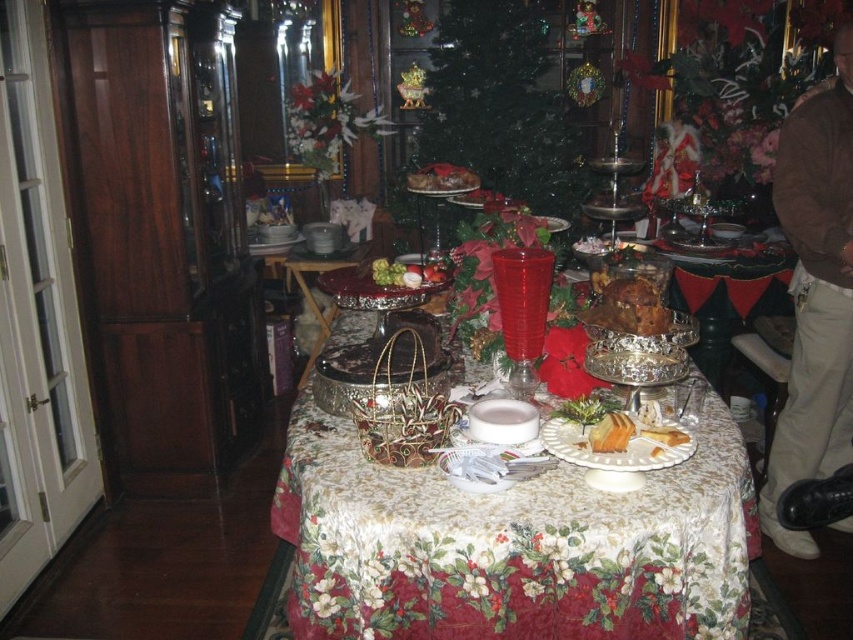
You are a guest at the Christmas dinner and want to take a photo of the shiny silver cake stand at center and the yellow cake at center. Which object should you focus on first if you want to capture both in a single frame without moving the camera?

You should focus on the shiny silver cake stand at center first because it is larger than the yellow cake at center, allowing it to be centered in the frame while still capturing the smaller yellow cake at center in the same shot.

You are a guest at a Christmas party and want to place a small gift box on the table. The gift box is 10 cm wide. Looking at the table, which object between the shiny silver cake stand at center and the yellow cake at center has enough space to place the gift box next to it?

The shiny silver cake stand at center has a larger width than the yellow cake at center, so placing the gift box next to the shiny silver cake stand at center would provide more space and a better fit for the 10 cm wide gift box.

You are a guest at a Christmas party and want to place your coat on the table without taking up too much space. You see the brown sweater at upper right and the green textured christmas tree at center. Which item should you choose to place your coat next to if you want to save space?

The brown sweater at upper right is thinner than the green textured christmas tree at center, so placing your coat next to the brown sweater at upper right would save more space.